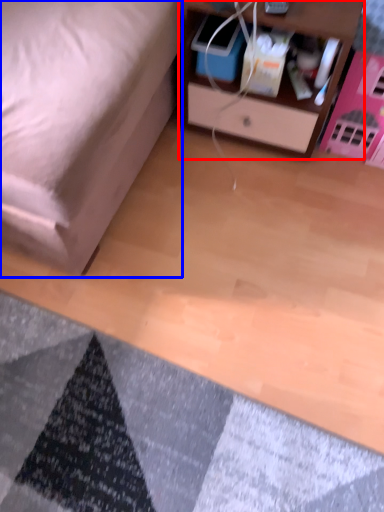
Question: Which object appears closest to the camera in this image, nightstand (highlighted by a red box) or furniture (highlighted by a blue box)?

Choices:
 (A) nightstand
 (B) furniture

Answer: (B)